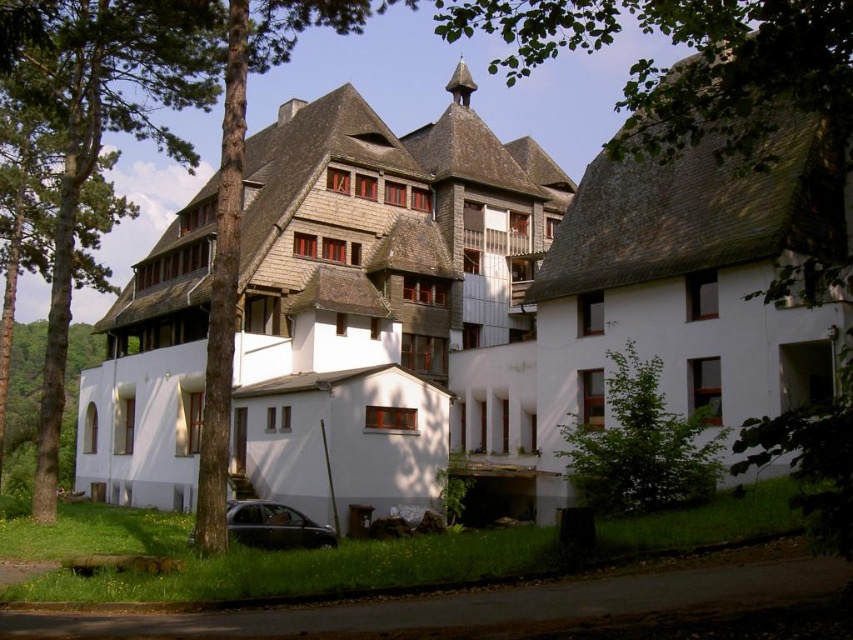
Question: Is the position of green leafy tree at lower right more distant than that of shiny black car at lower left?

Choices:
 (A) yes
 (B) no

Answer: (A)

Question: Based on their relative distances, which object is farther from the green leafy tree at upper center?

Choices:
 (A) green leafy tree at lower right
 (B) green leafy tree at left

Answer: (B)

Question: Which point is farther from the camera taking this photo?

Choices:
 (A) (772, 102)
 (B) (62, 378)
 (C) (630, 371)

Answer: (C)

Question: Which of the following is the closest to the observer?

Choices:
 (A) green leafy tree at lower right
 (B) green leafy tree at left

Answer: (A)

Question: Is green leafy tree at upper center further to the viewer compared to shiny black car at lower left?

Choices:
 (A) yes
 (B) no

Answer: (B)

Question: From the image, what is the correct spatial relationship of green leafy tree at upper center in relation to shiny black car at lower left?

Choices:
 (A) right
 (B) left

Answer: (A)